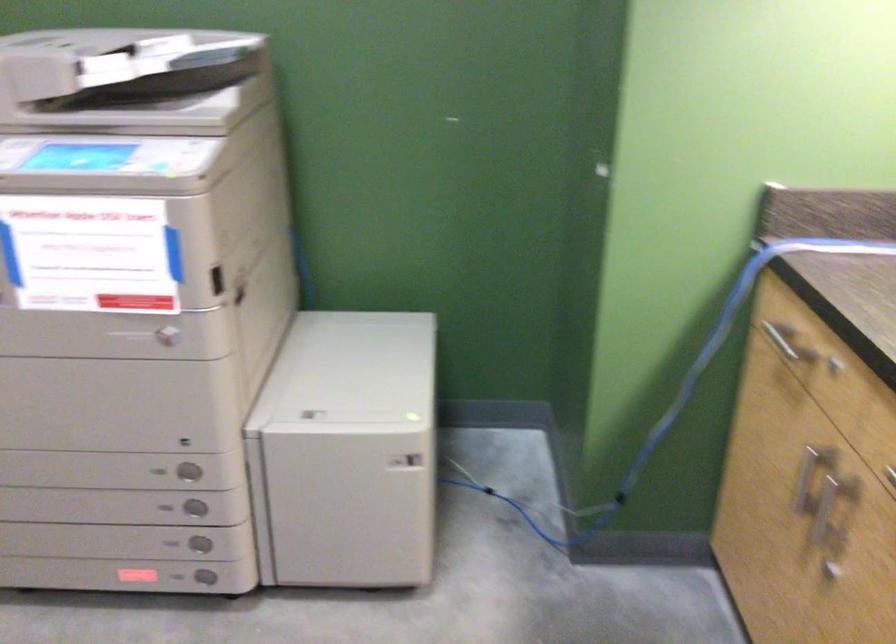
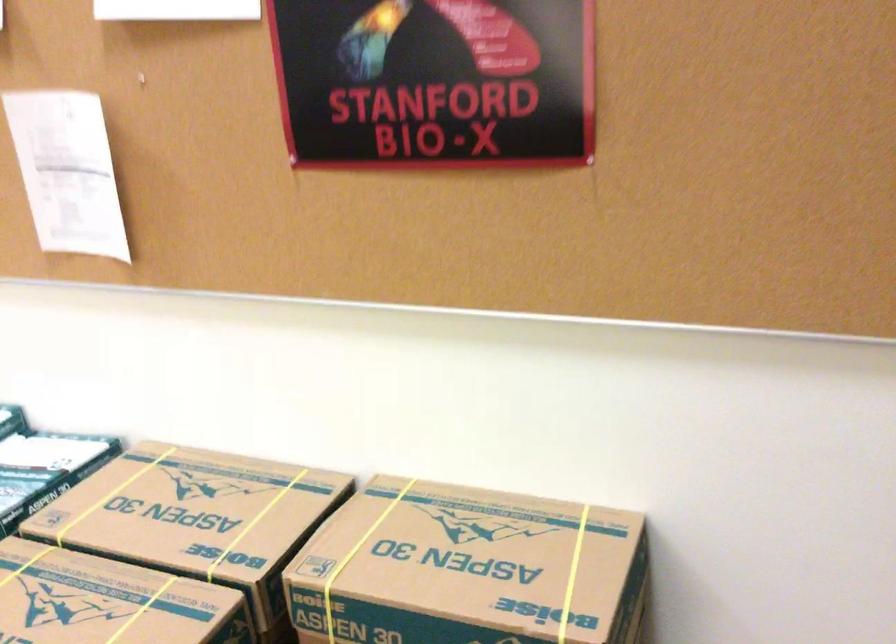
How did the camera likely rotate?

The rotation direction of the camera is left-down.